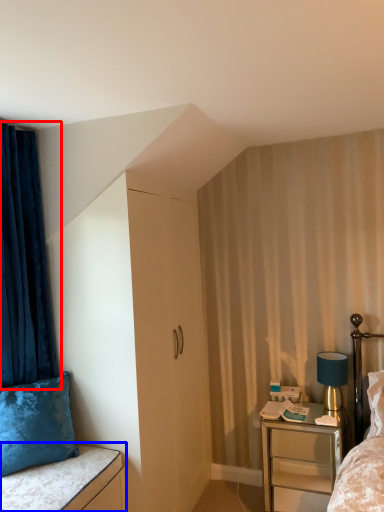
Question: Which object is further to the camera taking this photo, curtain (highlighted by a red box) or vanity (highlighted by a blue box)?

Choices:
 (A) curtain
 (B) vanity

Answer: (A)